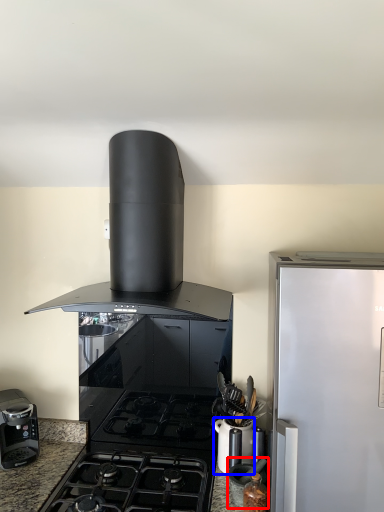
Question: Which of the following is the farthest to the observer, appliance (highlighted by a red box) or kitchen appliance (highlighted by a blue box)?

Choices:
 (A) appliance
 (B) kitchen appliance

Answer: (B)